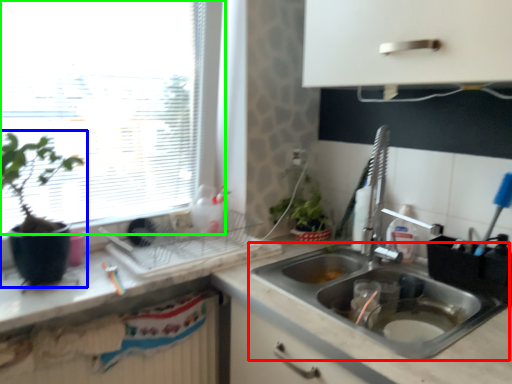
Question: Based on their relative distances, which object is farther from sink (highlighted by a red box)? Choose from houseplant (highlighted by a blue box) and window (highlighted by a green box).

Choices:
 (A) houseplant
 (B) window

Answer: (A)